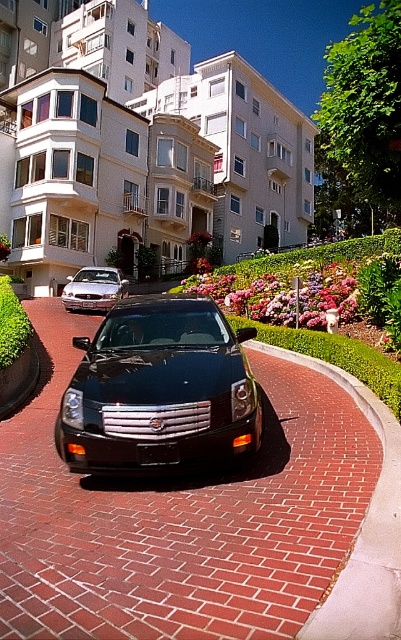
What do you see at coordinates (159, 388) in the screenshot? This screenshot has height=640, width=401. I see `glossy black car at center` at bounding box center [159, 388].

Is glossy black car at center further to the viewer compared to green grass at center?

No.

Which is in front, point (170, 307) or point (317, 323)?

Point (170, 307)

At what (x,y) coordinates should I click in order to perform the action: click on glossy black car at center. Please return your answer as a coordinate pair (x, y). This screenshot has height=640, width=401. Looking at the image, I should click on (159, 388).

Does point (139, 540) come in front of point (293, 339)?

Yes, it is.

Is black glossy car at center bigger than green grass at center?

No.

Is point (245, 568) positioned in front of point (273, 294)?

Yes, point (245, 568) is in front of point (273, 294).

Find the location of `black glossy car at center`. black glossy car at center is located at coordinates (x=180, y=516).

Locate an element on the screen. The image size is (401, 640). black glossy car at center is located at coordinates (180, 516).

Does point (30, 522) lie behind point (91, 300)?

No.

Does point (78, 499) come in front of point (83, 304)?

Yes, it is.

Where is `black glossy car at center`? The height and width of the screenshot is (640, 401). black glossy car at center is located at coordinates (180, 516).